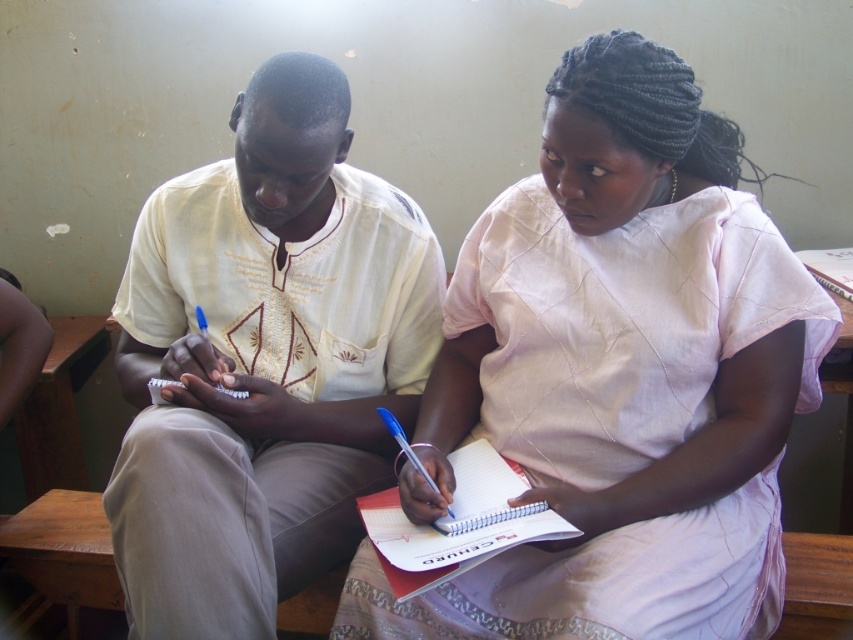
You are standing in front of the wooden desk and want to hand a document to both the light pink fabric dress at center and the light beige embroidered shirt at center. Which person should you approach first based on their proximity to you?

You should approach the light pink fabric dress at center first because they are closer to you than the light beige embroidered shirt at center.

You are a photographer standing in front of the wooden desk where two people are sitting. You want to take a photo of the light pink fabric dress at center and the light beige embroidered shirt at center. Which one is positioned to the right side of the other?

The light pink fabric dress at center is to the right of the light beige embroidered shirt at center.

Looking at this image, you are standing in front of the wooden desk where both individuals are seated. You need to place a new notebook exactly between the two people. Where should you place it in relation to the light pink fabric dress at center?

The light pink fabric dress at center is located at point (x=618, y=376). To place the notebook between the two individuals, you should position it near the center of the desk, which aligns with the dress at that coordinate.